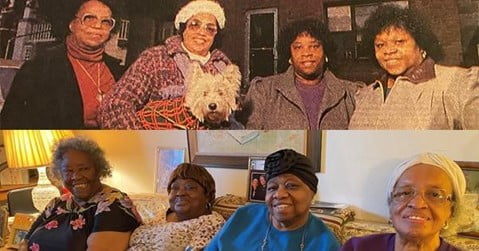
Locate an element on the screen. This screenshot has height=251, width=479. wooden frame is located at coordinates (227, 166).